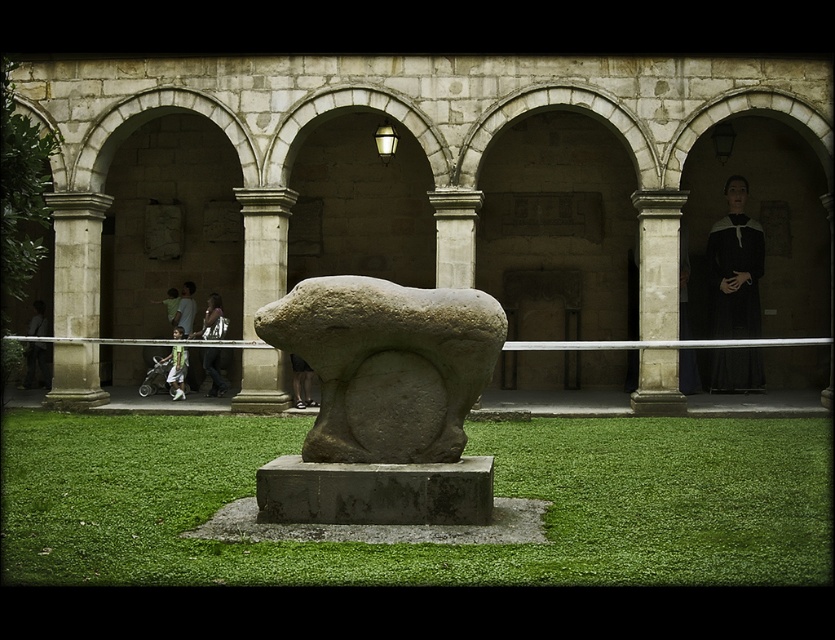
You are an artist standing in the courtyard and want to sketch the black woolen robe at right and the green fabric pants at center. Which object is covering the other?

The black woolen robe at right is positioned over the green fabric pants at center, so it is covering the pants.

You are standing in the courtyard looking at the bull sculpture. There are two points marked in the scene. The first point is at coordinates point (28, 470) and the second is at point (171, 355). Which point is nearer to you?

Point (28, 470) is closer to the viewer than point (171, 355).